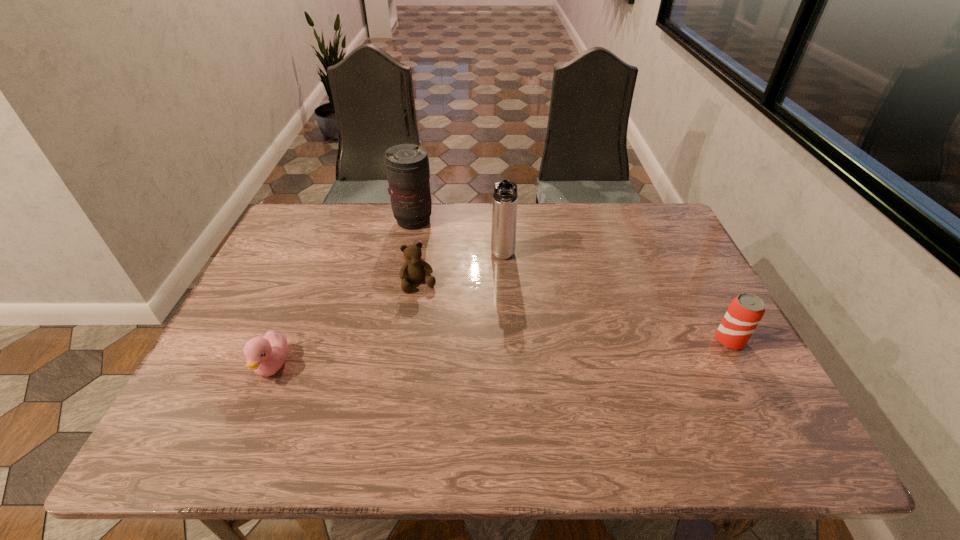
Image resolution: width=960 pixels, height=540 pixels. Find the location of `vacant area that lies between the beer can and the fourth object from left to right`. vacant area that lies between the beer can and the fourth object from left to right is located at coordinates (616, 299).

Find the location of a particular element. free space between the telephoto lens and the rightmost object is located at coordinates (571, 281).

Find the location of `vacant space that's between the farthest object and the duckling`. vacant space that's between the farthest object and the duckling is located at coordinates (343, 293).

The height and width of the screenshot is (540, 960). In order to click on vacant area that lies between the fourth object from left to right and the shortest object in this screenshot , I will do `click(388, 312)`.

Where is `vacant area that lies between the teddy bear and the duckling`? vacant area that lies between the teddy bear and the duckling is located at coordinates (346, 325).

Locate an element on the screen. free space between the beer can and the third nearest object is located at coordinates (574, 312).

Where is `free space between the teddy bear and the leftmost object`? free space between the teddy bear and the leftmost object is located at coordinates (346, 325).

Where is `object that is the second closest to the teddy bear`? Image resolution: width=960 pixels, height=540 pixels. object that is the second closest to the teddy bear is located at coordinates (407, 165).

Identify which object is the third closest to the farthest object. Please provide its 2D coordinates. Your answer should be formatted as a tuple, i.e. [(x, y)], where the tuple contains the x and y coordinates of a point satisfying the conditions above.

[(266, 355)]